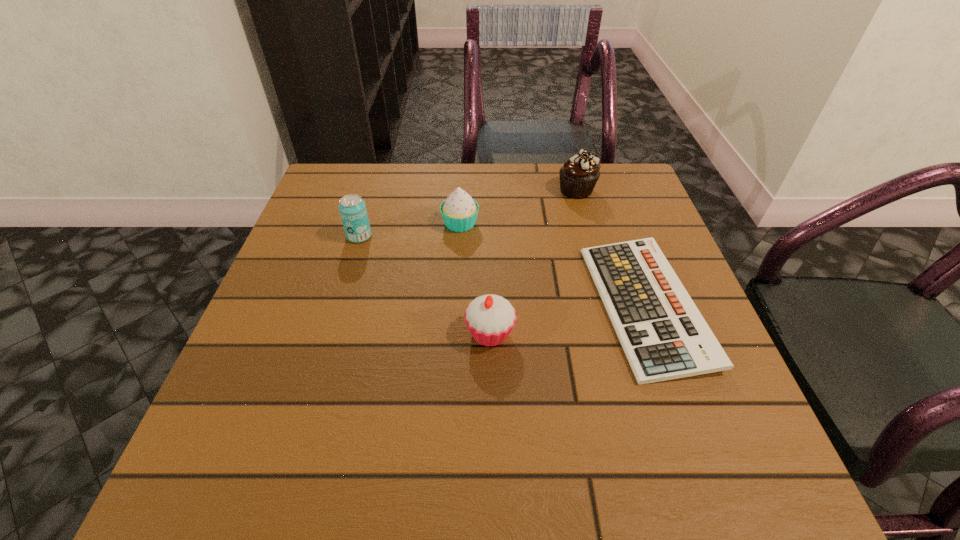
The height and width of the screenshot is (540, 960). In order to click on free area in between the rightmost cupcake and the second farthest cupcake in this screenshot , I will do `click(518, 207)`.

Identify the location of blank region between the second farthest cupcake and the leftmost object. Image resolution: width=960 pixels, height=540 pixels. (410, 230).

I want to click on free area in between the second farthest cupcake and the computer keyboard, so click(553, 265).

Find the location of `empty space that is in between the beer can and the second nearest cupcake`. empty space that is in between the beer can and the second nearest cupcake is located at coordinates (410, 230).

This screenshot has height=540, width=960. Identify the location of free area in between the second farthest cupcake and the leftmost object. (410, 230).

Where is `free space between the computer keyboard and the second nearest cupcake`? The height and width of the screenshot is (540, 960). free space between the computer keyboard and the second nearest cupcake is located at coordinates (553, 265).

Locate an element on the screen. This screenshot has width=960, height=540. blank region between the nearest cupcake and the computer keyboard is located at coordinates (567, 320).

At what (x,y) coordinates should I click in order to perform the action: click on free space between the leftmost object and the nearest cupcake. Please return your answer as a coordinate pair (x, y). Looking at the image, I should click on (424, 285).

Find the location of `free spot between the shortest object and the leftmost object`. free spot between the shortest object and the leftmost object is located at coordinates (502, 271).

What are the coordinates of `object that can be found as the closest to the shortest object` in the screenshot? It's located at (490, 318).